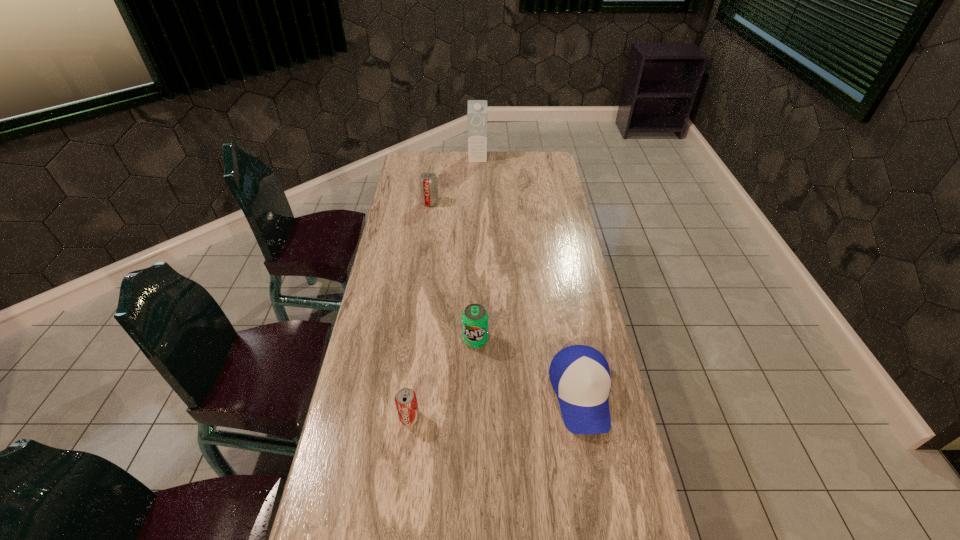
At what (x,y) coordinates should I click in order to perform the action: click on the farthest object. Please return your answer as a coordinate pair (x, y). This screenshot has width=960, height=540. Looking at the image, I should click on (477, 109).

I want to click on carton, so click(477, 109).

The height and width of the screenshot is (540, 960). Find the location of `the farthest soda can`. the farthest soda can is located at coordinates (428, 181).

The image size is (960, 540). I want to click on the third farthest object, so click(474, 318).

Where is `the rightmost soda can`? Image resolution: width=960 pixels, height=540 pixels. the rightmost soda can is located at coordinates tap(474, 318).

Where is `the rightmost object`? the rightmost object is located at coordinates (579, 374).

Find the location of a particular element. The image size is (960, 540). the shortest soda can is located at coordinates (406, 403).

This screenshot has width=960, height=540. What are the coordinates of `vacant space located on the front label of the carton` in the screenshot? It's located at (477, 205).

Locate an element on the screen. This screenshot has height=540, width=960. vacant space located 0.090m on the back of the second farthest object is located at coordinates (433, 187).

Image resolution: width=960 pixels, height=540 pixels. Find the location of `free location located on the front-facing side of the third farthest object`. free location located on the front-facing side of the third farthest object is located at coordinates (475, 388).